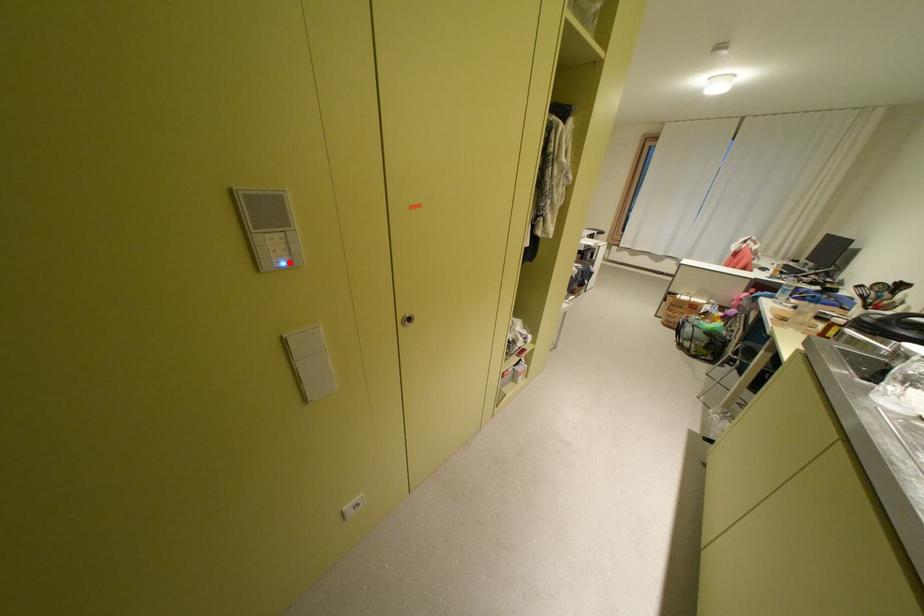
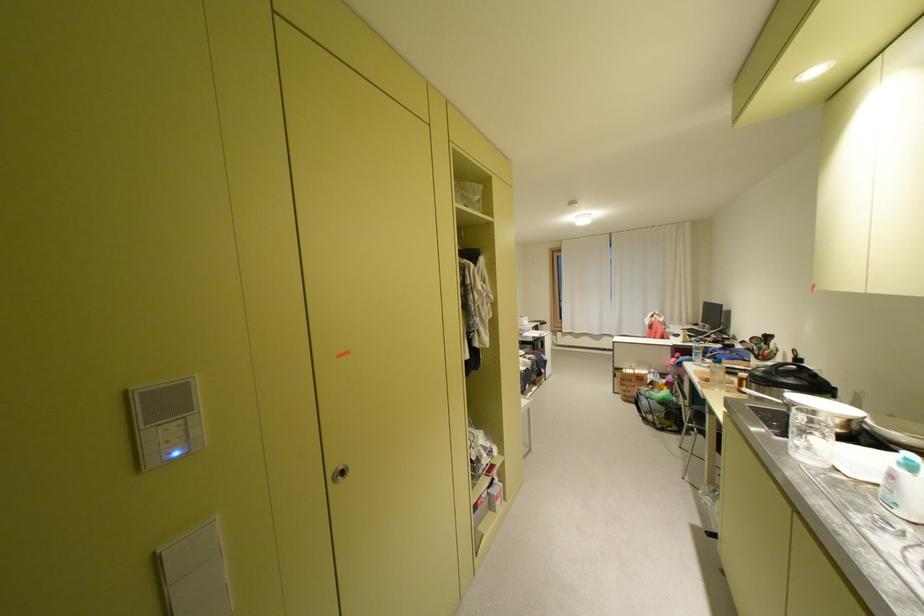
Question: I am providing you with two images of the same scene from different viewpoints. A red point is marked on the first image. Can you still see the location of the red point in image 2?

Choices:
 (A) Yes
 (B) No

Answer: (A)